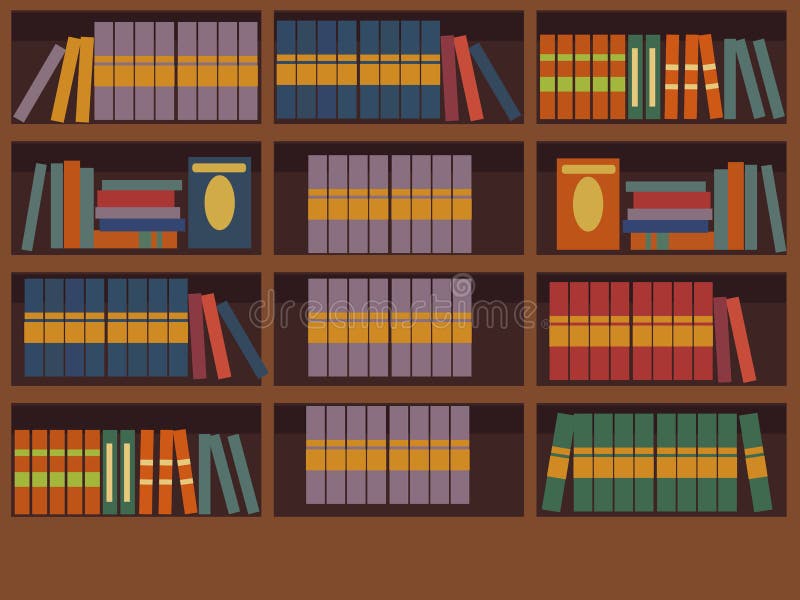
The height and width of the screenshot is (600, 800). In order to click on green books with yellow stripe in this screenshot , I will do `click(550, 501)`, `click(581, 500)`, `click(600, 496)`, `click(618, 496)`, `click(642, 500)`, `click(664, 500)`, `click(681, 500)`, `click(709, 501)`, `click(722, 501)`, `click(760, 501)`.